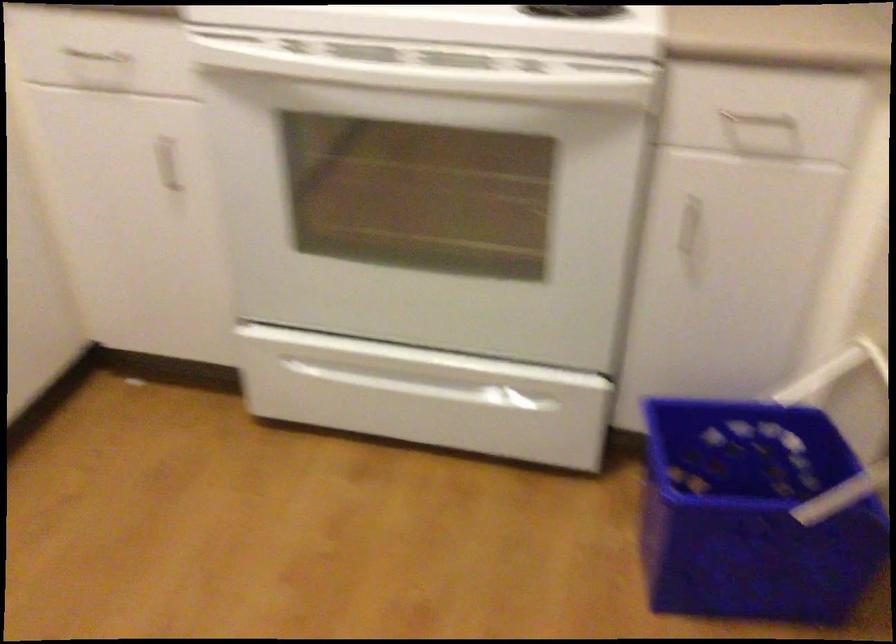
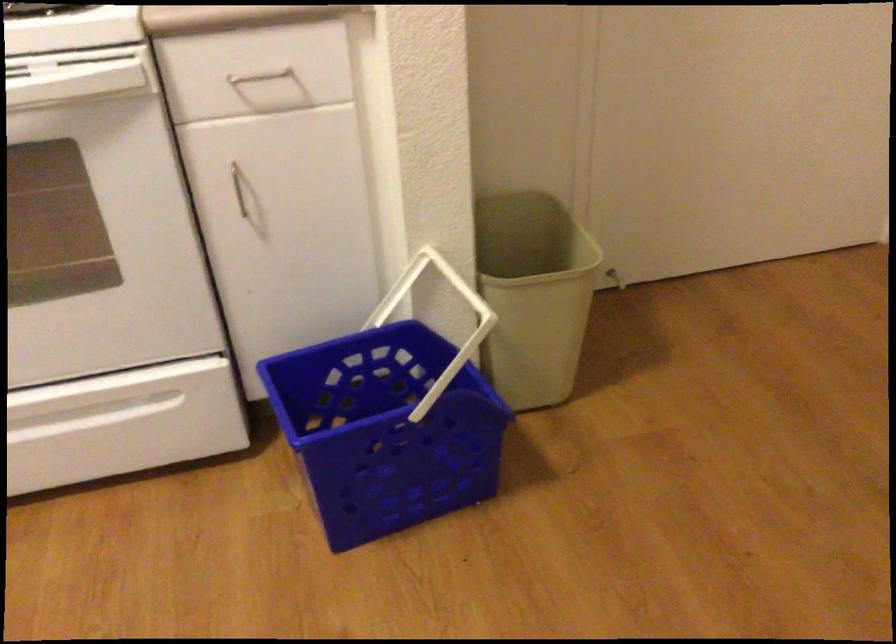
Which direction would the cameraman need to move to produce the second image?

The movement direction of the cameraman is right, backward.